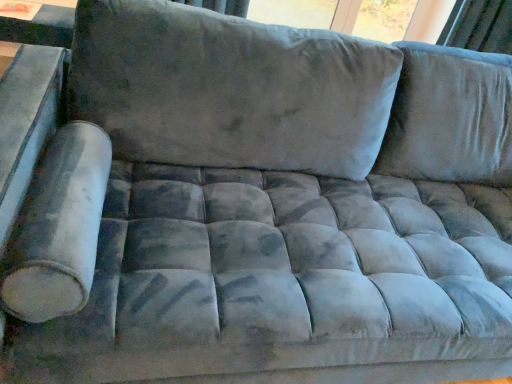
Describe the element at coordinates (479, 26) in the screenshot. The height and width of the screenshot is (384, 512). I see `velvet curtain at upper right` at that location.

This screenshot has width=512, height=384. In order to click on velvet curtain at upper right in this screenshot , I will do `click(479, 26)`.

You are a GUI agent. You are given a task and a screenshot of the screen. Output one action in this format:
    pyautogui.click(x=<x>, y=<y>)
    Task: Click on the velvet curtain at upper right
    
    Given the screenshot: What is the action you would take?
    pyautogui.click(x=479, y=26)